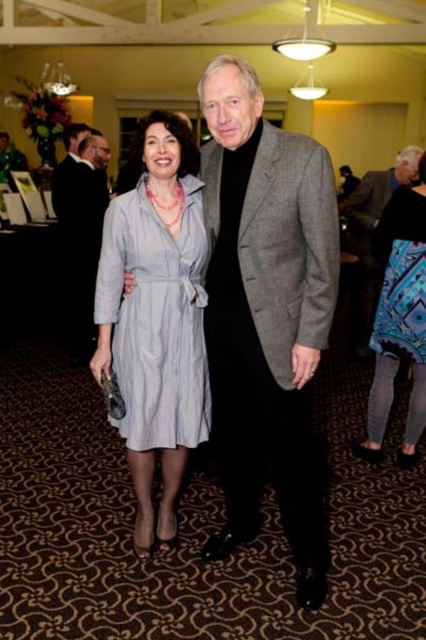
You are a photographer adjusting your camera settings for the event. You notice two points in the image at coordinates point (66, 180) and point (391, 346). Which point is closer to the camera lens?

Point (66, 180) is further to the camera than point (391, 346), so the point closer to the camera lens is point (66, 180).

You are a photographer at a fashion show and need to arrange these two dresses for a photo shoot. Given the light blue linen dress at center and the blue patterned fabric dress at lower right, which dress should be placed in the front to ensure both are visible in the photo?

The blue patterned fabric dress at lower right should be placed in the front because the light blue linen dress at center is much taller, so positioning the shorter one forward will allow both dresses to be visible without one blocking the other.

You are a photographer at a social event. You need to position a backdrop that is 1.5 meters tall. Based on the scene, which object between the black suit at left and the blue patterned fabric dress at lower right would you use as a reference to ensure the backdrop is tall enough?

The black suit at left is taller than the blue patterned fabric dress at lower right. Since the backdrop needs to be 1.5 meters tall, you should use the black suit at left as a reference because it is taller and would ensure the backdrop meets the required height.